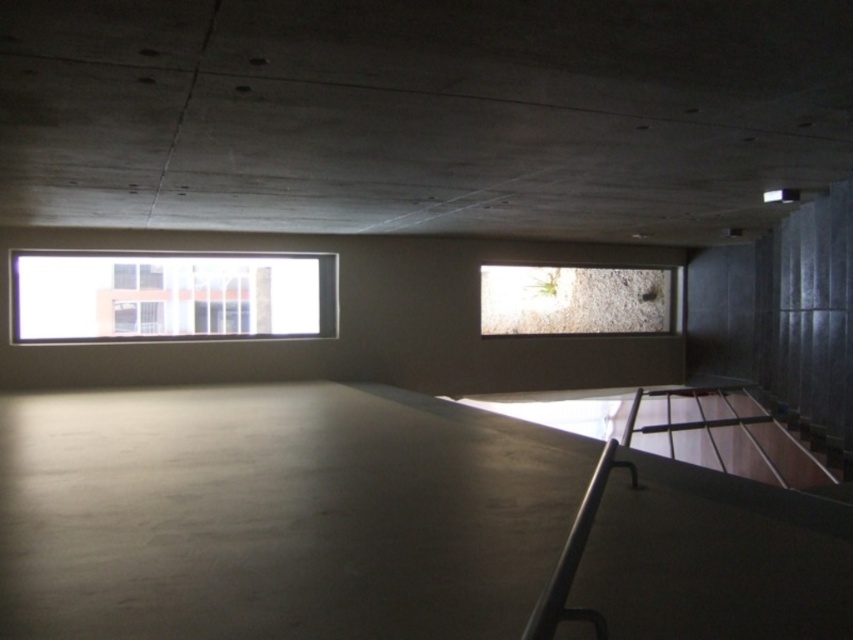
Is smooth concrete floor at center smaller than transparent glass window at upper left?

Indeed, smooth concrete floor at center has a smaller size compared to transparent glass window at upper left.

Between smooth concrete floor at center and transparent glass window at upper left, which one has more height?

Standing taller between the two is transparent glass window at upper left.

Who is more forward, (498, 589) or (131, 253)?

Point (498, 589) is more forward.

You are a GUI agent. You are given a task and a screenshot of the screen. Output one action in this format:
    pyautogui.click(x=<x>, y=<y>)
    Task: Click on the smooth concrete floor at center
    
    Given the screenshot: What is the action you would take?
    pyautogui.click(x=277, y=515)

Can you confirm if smooth concrete floor at center is taller than clear glass window at center?

Incorrect, smooth concrete floor at center's height is not larger of clear glass window at center's.

Is smooth concrete floor at center thinner than clear glass window at center?

Yes.

Is point (660, 576) positioned in front of point (579, 300)?

Yes, it is in front of point (579, 300).

At what (x,y) coordinates should I click in order to perform the action: click on smooth concrete floor at center. Please return your answer as a coordinate pair (x, y). Looking at the image, I should click on (277, 515).

Is point (59, 307) positioned in front of point (581, 310)?

Yes.

Between transparent glass window at upper left and clear glass window at center, which one appears on the left side from the viewer's perspective?

transparent glass window at upper left

The height and width of the screenshot is (640, 853). What do you see at coordinates (170, 296) in the screenshot?
I see `transparent glass window at upper left` at bounding box center [170, 296].

Where is `transparent glass window at upper left`? The height and width of the screenshot is (640, 853). transparent glass window at upper left is located at coordinates click(170, 296).